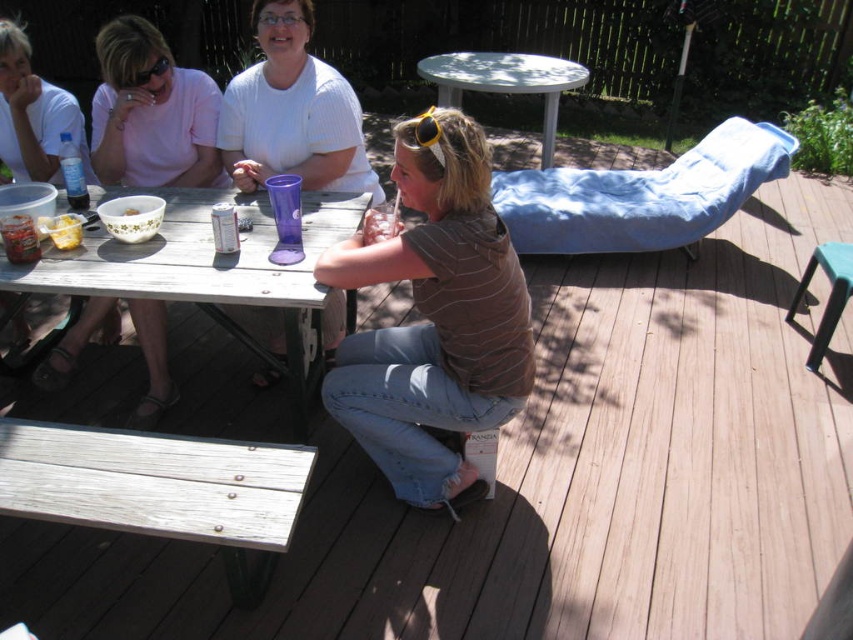
You are standing at the edge of the wooden deck and want to place a new item on the table. Which object, the wooden picnic table at lower left or the white glossy bowl at upper left, is positioned higher up on the image?

The white glossy bowl at upper left is positioned higher up in the image than the wooden picnic table at lower left.